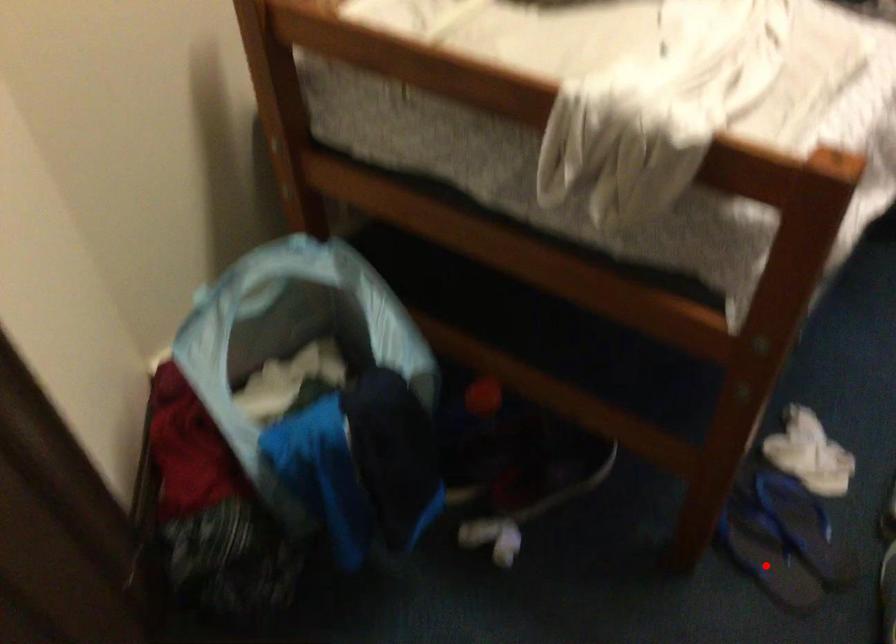
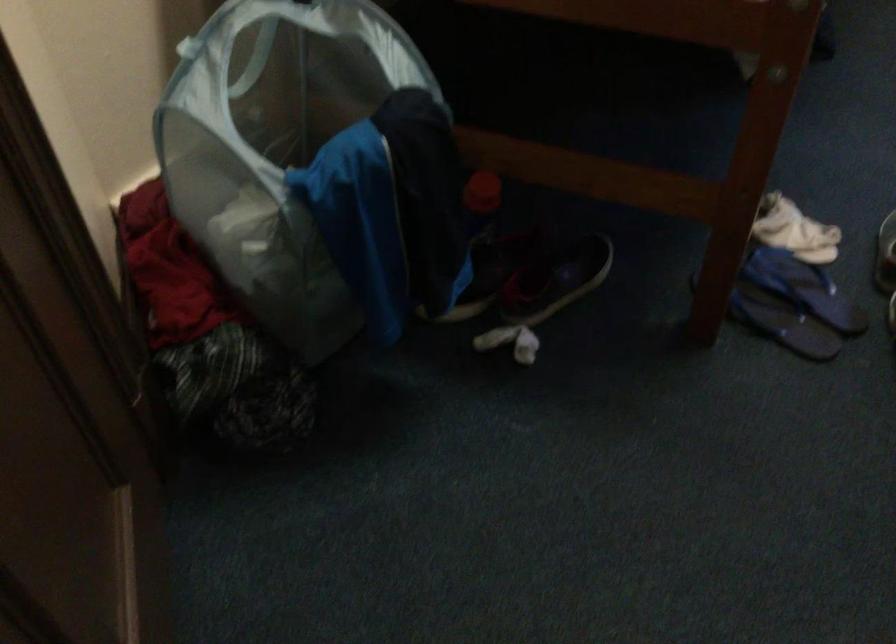
Locate, in the second image, the point that corresponds to the highlighted location in the first image.

(782, 323)